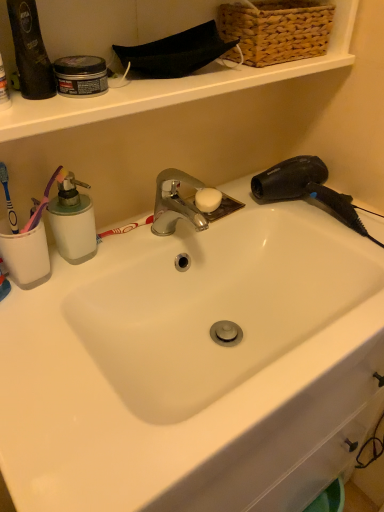
Where is `unoccupied area in front of blue plastic toothbrush at left`? unoccupied area in front of blue plastic toothbrush at left is located at coordinates (31, 317).